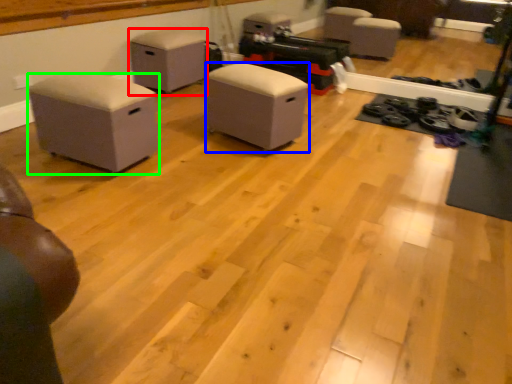
Question: Which is farther away from furniture (highlighted by a red box)? furniture (highlighted by a blue box) or furniture (highlighted by a green box)?

Choices:
 (A) furniture
 (B) furniture

Answer: (B)